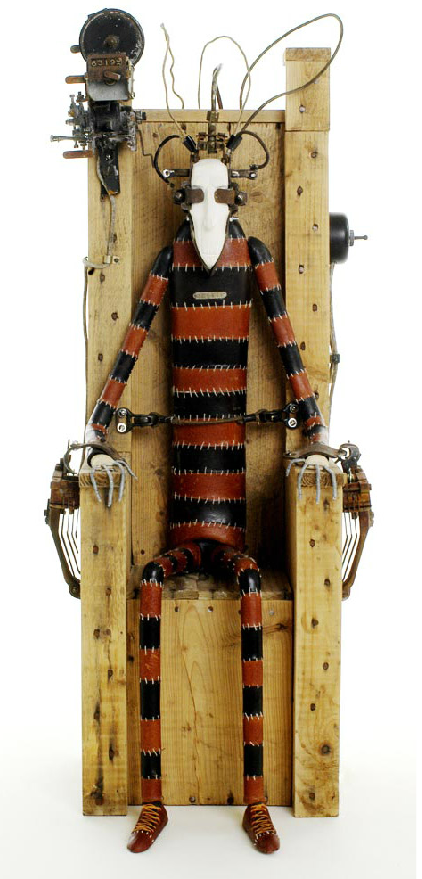
Identify the location of lace. (142, 816), (258, 814).